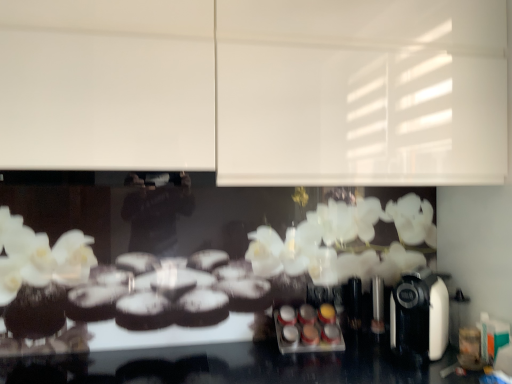
Question: Is the depth of white matte cabinet at upper center greater than that of metallic silver spice rack at center?

Choices:
 (A) yes
 (B) no

Answer: (B)

Question: Is white matte cabinet at upper center turned away from metallic silver spice rack at center?

Choices:
 (A) yes
 (B) no

Answer: (B)

Question: Is white matte cabinet at upper center oriented towards metallic silver spice rack at center?

Choices:
 (A) no
 (B) yes

Answer: (A)

Question: Can you confirm if white matte cabinet at upper center is shorter than metallic silver spice rack at center?

Choices:
 (A) no
 (B) yes

Answer: (A)

Question: Is white matte cabinet at upper center closer to camera compared to metallic silver spice rack at center?

Choices:
 (A) yes
 (B) no

Answer: (A)

Question: Relative to black plastic coffee machine at right, is metallic silver spice rack at center in front or behind?

Choices:
 (A) front
 (B) behind

Answer: (B)

Question: Based on their sizes in the image, would you say metallic silver spice rack at center is bigger or smaller than black plastic coffee machine at right?

Choices:
 (A) small
 (B) big

Answer: (A)

Question: From a real-world perspective, is metallic silver spice rack at center positioned above or below black plastic coffee machine at right?

Choices:
 (A) below
 (B) above

Answer: (A)

Question: In terms of height, does metallic silver spice rack at center look taller or shorter compared to black plastic coffee machine at right?

Choices:
 (A) short
 (B) tall

Answer: (A)

Question: From their relative heights in the image, would you say black plastic coffee machine at right is taller or shorter than white matte cabinet at upper center?

Choices:
 (A) tall
 (B) short

Answer: (B)

Question: In the image, is black plastic coffee machine at right on the left side or the right side of white matte cabinet at upper center?

Choices:
 (A) left
 (B) right

Answer: (B)

Question: From a real-world perspective, is black plastic coffee machine at right above or below white matte cabinet at upper center?

Choices:
 (A) below
 (B) above

Answer: (A)

Question: Is point (416, 332) positioned closer to the camera than point (371, 84)?

Choices:
 (A) farther
 (B) closer

Answer: (A)

Question: Relative to white matte cabinet at upper center, is metallic silver spice rack at center in front or behind?

Choices:
 (A) front
 (B) behind

Answer: (B)

Question: From the image's perspective, relative to white matte cabinet at upper center, is metallic silver spice rack at center above or below?

Choices:
 (A) below
 (B) above

Answer: (A)